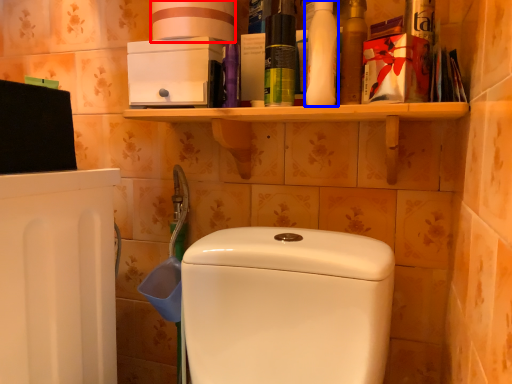
Question: Among these objects, which one is farthest to the camera, toilet paper (highlighted by a red box) or cleaning product (highlighted by a blue box)?

Choices:
 (A) toilet paper
 (B) cleaning product

Answer: (A)